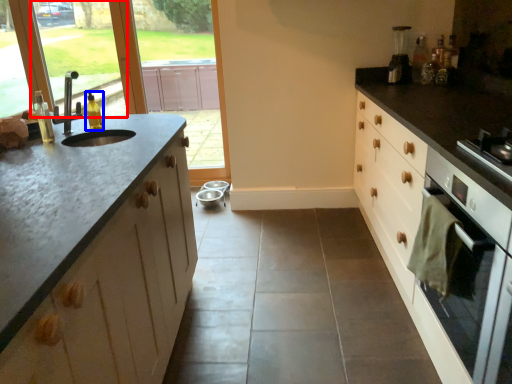
Question: Which point is further to the camera, window screen (highlighted by a red box) or bottle (highlighted by a blue box)?

Choices:
 (A) window screen
 (B) bottle

Answer: (A)